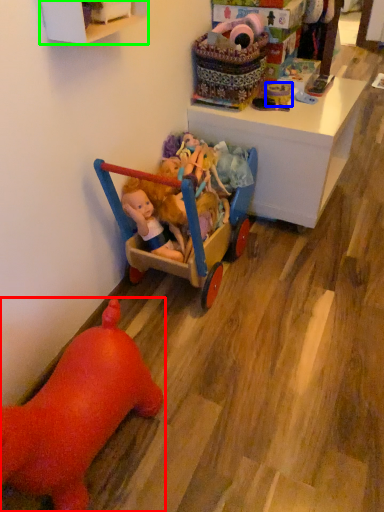
Question: Which is nearer to the toy (highlighted by a red box)? toy (highlighted by a blue box) or cabinetry (highlighted by a green box).

Choices:
 (A) toy
 (B) cabinetry

Answer: (B)